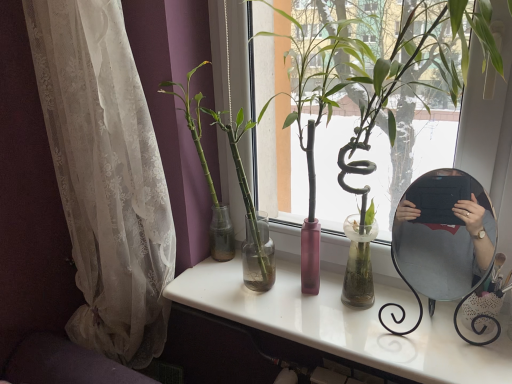
Where is `free space in front of metallic silver mirror at right`? The width and height of the screenshot is (512, 384). free space in front of metallic silver mirror at right is located at coordinates (454, 361).